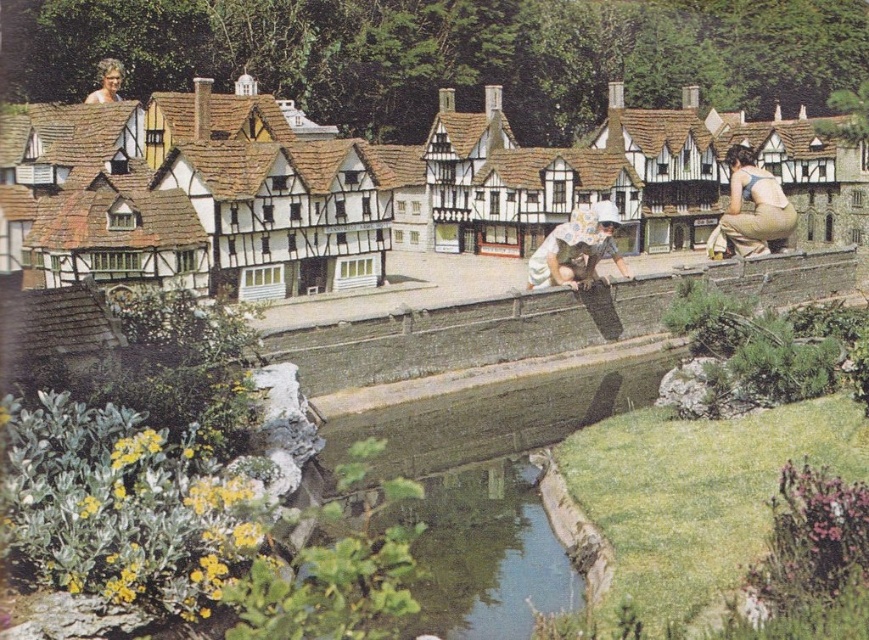
Between green concrete waterway at lower center and blonde hair at upper left, which one is positioned higher?

blonde hair at upper left

Consider the image. Can you confirm if green concrete waterway at lower center is shorter than blonde hair at upper left?

Incorrect, green concrete waterway at lower center's height does not fall short of blonde hair at upper left's.

Who is more forward, (519, 451) or (111, 100)?

Point (519, 451) is in front.

Find the location of a particular element. The image size is (869, 640). green concrete waterway at lower center is located at coordinates (491, 488).

In the scene shown: Is green concrete waterway at lower center below light brown fabric overalls at right?

Indeed, green concrete waterway at lower center is positioned under light brown fabric overalls at right.

Is point (565, 426) more distant than point (747, 225)?

No, (565, 426) is closer to viewer.

Does point (574, 586) come in front of point (740, 208)?

Yes, it is.

At what (x,y) coordinates should I click in order to perform the action: click on green concrete waterway at lower center. Please return your answer as a coordinate pair (x, y). This screenshot has width=869, height=640. Looking at the image, I should click on (491, 488).

Does floral fabric dress at center have a lesser height compared to blonde hair at upper left?

No, floral fabric dress at center is not shorter than blonde hair at upper left.

Locate an element on the screen. floral fabric dress at center is located at coordinates (576, 248).